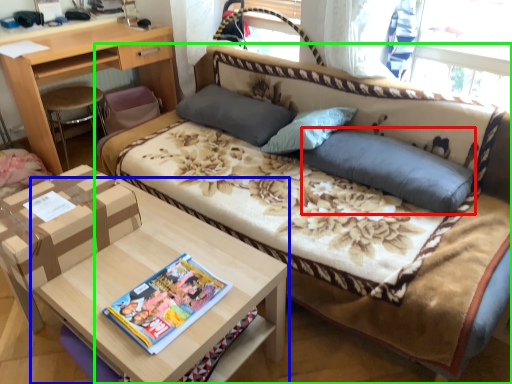
Question: Which object is positioned farthest from pillow (highlighted by a red box)? Select from table (highlighted by a blue box) and studio couch (highlighted by a green box).

Choices:
 (A) table
 (B) studio couch

Answer: (A)